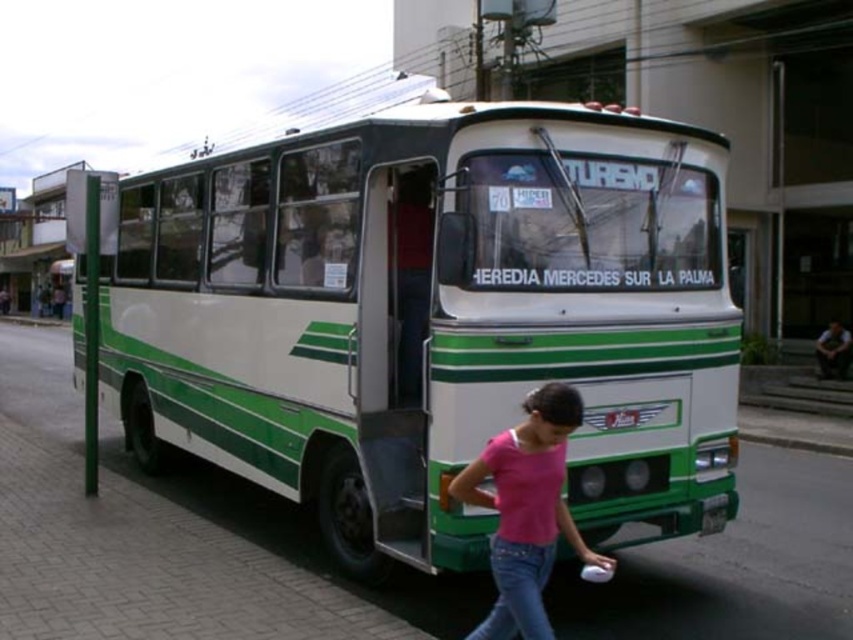
Question: Does white/green painted bus at center have a greater width compared to pink matte shirt at lower center?

Choices:
 (A) yes
 (B) no

Answer: (B)

Question: Which object is closer to the camera taking this photo?

Choices:
 (A) white/green painted bus at center
 (B) pink matte shirt at lower center

Answer: (B)

Question: Is the position of white/green painted bus at center less distant than that of pink matte shirt at lower center?

Choices:
 (A) no
 (B) yes

Answer: (A)

Question: Observing the image, what is the correct spatial positioning of white/green painted bus at center in reference to pink matte shirt at lower center?

Choices:
 (A) right
 (B) left

Answer: (B)